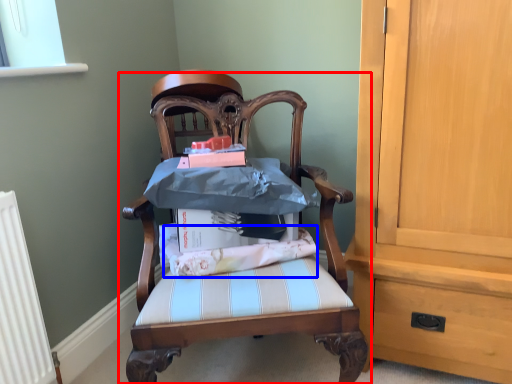
Question: Which point is closer to the camera, chair (highlighted by a red box) or fabric (highlighted by a blue box)?

Choices:
 (A) chair
 (B) fabric

Answer: (A)